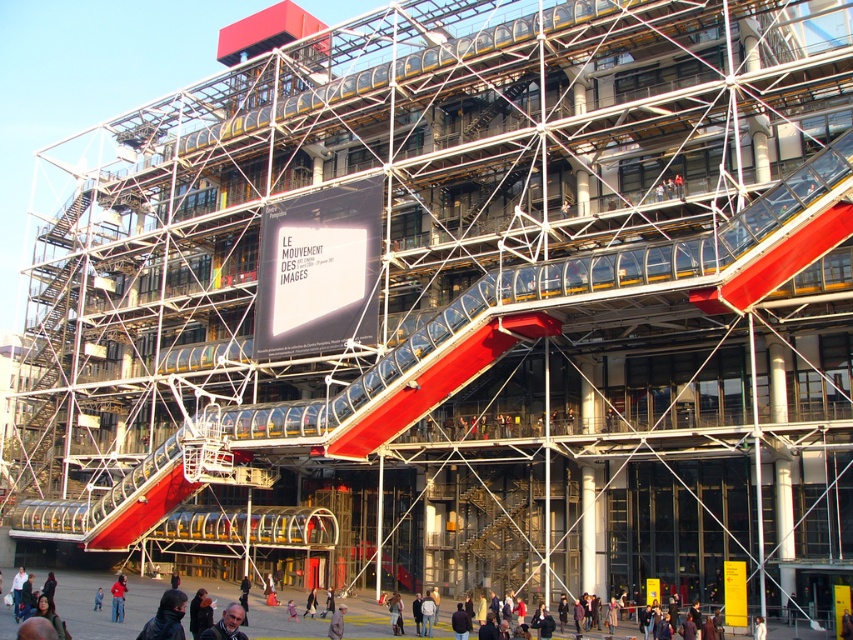
Does dark blue jacket at lower center have a larger size compared to light gray fabric jacket at center?

Correct, dark blue jacket at lower center is larger in size than light gray fabric jacket at center.

Based on the photo, does dark blue jacket at lower center appear on the right side of light gray fabric jacket at center?

No, dark blue jacket at lower center is not to the right of light gray fabric jacket at center.

This screenshot has width=853, height=640. What do you see at coordinates (225, 625) in the screenshot?
I see `dark blue jacket at lower center` at bounding box center [225, 625].

Image resolution: width=853 pixels, height=640 pixels. Identify the location of dark blue jacket at lower center. (225, 625).

Between light brown leather jacket at center and light gray fabric jacket at center, which one is positioned lower?

light gray fabric jacket at center is lower down.

Between point (340, 612) and point (314, 600), which one is positioned in front?

Positioned in front is point (340, 612).

Identify the location of light brown leather jacket at center. The image size is (853, 640). (335, 621).

How distant is dark blue jacket at lower left from blue denim jacket at center?

They are 11.38 meters apart.

Is point (143, 634) positioned before point (99, 604)?

Yes, point (143, 634) is closer to viewer.

You are a GUI agent. You are given a task and a screenshot of the screen. Output one action in this format:
    pyautogui.click(x=<x>, y=<y>)
    Task: Click on the dark blue jacket at lower left
    
    Given the screenshot: What is the action you would take?
    pyautogui.click(x=166, y=618)